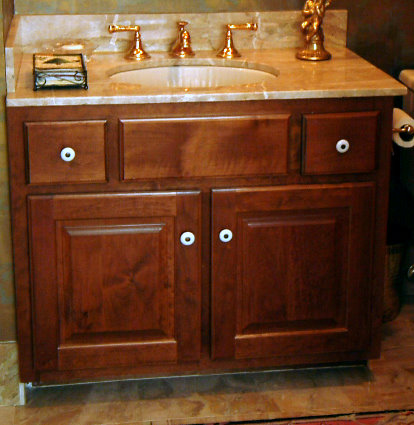
Identify the location of cabinets. (144, 284), (280, 275).